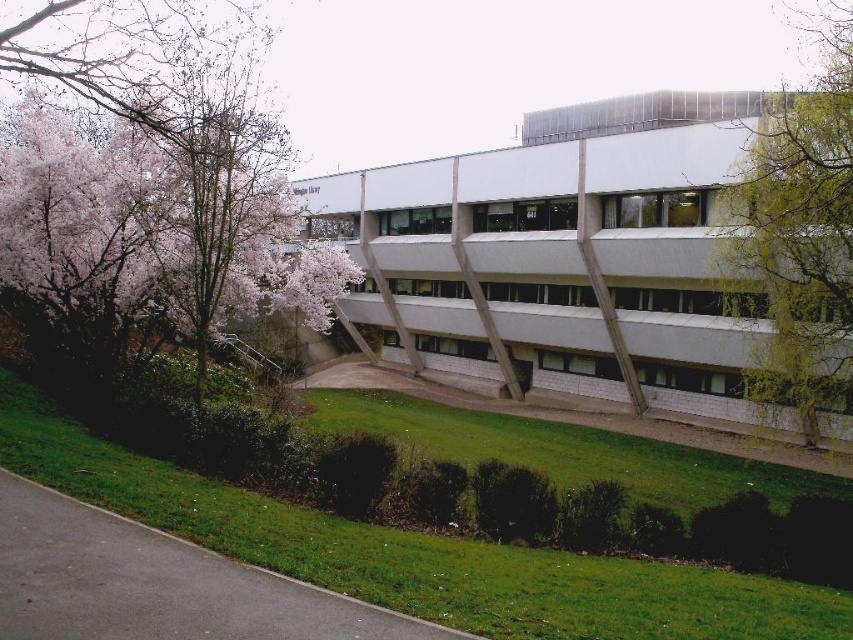
You are a landscape architect planning to install a new bench between the pink blossoming tree at left and the green leafy tree at right. The bench requires at least 15 meters of space between the two trees to be placed comfortably. Based on the scene, will there be enough space for the bench?

The pink blossoming tree at left and green leafy tree at right are 19.44 meters apart from each other, which is more than the required 15 meters. Therefore, there is enough space to comfortably place the bench between them.

You are standing in front of the modern building and notice two trees. The pink blossoming tree at left and the green leafy tree at right. Which tree is positioned more to the left side of the scene?

The pink blossoming tree at left is positioned more to the left side of the scene compared to the green leafy tree at right.